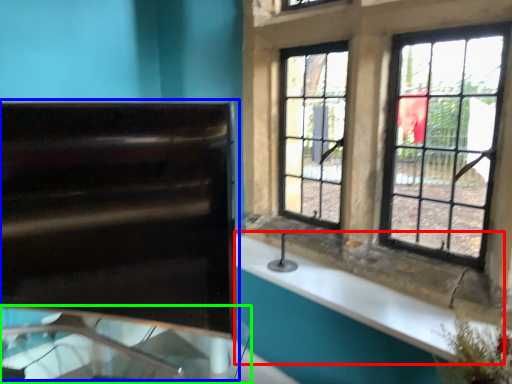
Question: Which object is positioned closest to counter top (highlighted by a red box)? Select from sink (highlighted by a blue box) and glass table (highlighted by a green box).

Choices:
 (A) sink
 (B) glass table

Answer: (B)